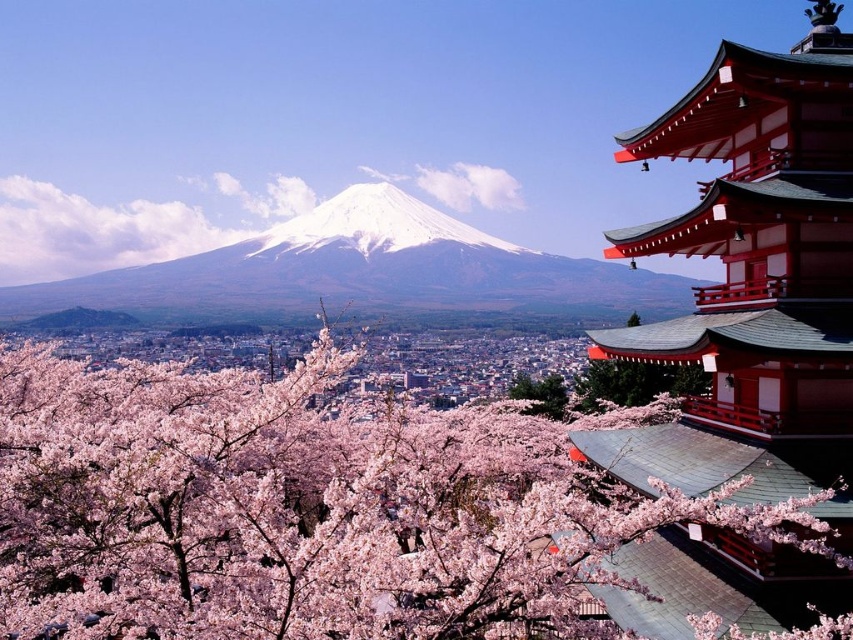
You are an artist planning to paint a landscape of the scene. You want to ensure the pink blossoms at center and the green leafy tree at center are proportionally accurate. Which object should you paint taller?

The pink blossoms at center should be painted taller since they have a greater height compared to the green leafy tree at center according to the description.